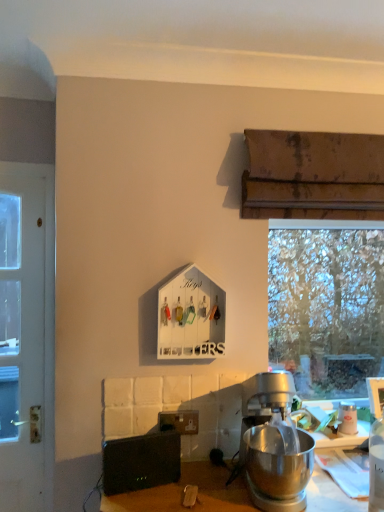
This screenshot has height=512, width=384. In order to click on white painted wood door at left in this screenshot , I will do `click(26, 337)`.

Locate an element on the screen. white glossy coffee cup at upper right is located at coordinates (347, 417).

What do you see at coordinates (326, 307) in the screenshot?
I see `transparent glass window at right` at bounding box center [326, 307].

Find the location of a particular element. This screenshot has height=512, width=384. transparent glass window at right is located at coordinates (326, 307).

You are a GUI agent. You are given a task and a screenshot of the screen. Output one action in this format:
    pyautogui.click(x=<x>, y=<y>)
    Task: Click on the white painted wood door at left
    
    Given the screenshot: What is the action you would take?
    pyautogui.click(x=26, y=337)

Is white glossy coffee cup at upper right shorter than transparent glass window at right?

Correct, white glossy coffee cup at upper right is not as tall as transparent glass window at right.

Is white glossy coffee cup at upper right turned away from transparent glass window at right?

Absolutely, white glossy coffee cup at upper right is directed away from transparent glass window at right.

From the image's perspective, is white glossy coffee cup at upper right below transparent glass window at right?

Yes, from the image's perspective, white glossy coffee cup at upper right is beneath transparent glass window at right.

Is transparent glass window at right beside white painted wood door at left?

No, transparent glass window at right is not touching white painted wood door at left.

Which of these two, transparent glass window at right or white painted wood door at left, is thinner?

With smaller width is white painted wood door at left.

From a real-world perspective, who is located higher, transparent glass window at right or white painted wood door at left?

transparent glass window at right is physically above.

Between point (318, 339) and point (27, 508), which one is positioned behind?

The point (318, 339) is farther.

In terms of width, does white glossy coffee cup at upper right look wider or thinner when compared to white painted wood door at left?

In the image, white glossy coffee cup at upper right appears to be more narrow than white painted wood door at left.

In the image, is white glossy coffee cup at upper right positioned in front of or behind white painted wood door at left?

In the image, white glossy coffee cup at upper right appears in front of white painted wood door at left.

Which point is more distant from viewer, (343, 413) or (17, 256)?

Positioned behind is point (17, 256).

Who is bigger, black plastic speaker at lower left or white painted wood door at left?

Bigger between the two is white painted wood door at left.

In the scene shown: Is black plastic speaker at lower left in front of or behind white painted wood door at left in the image?

In the image, black plastic speaker at lower left appears in front of white painted wood door at left.

Which object is wider, black plastic speaker at lower left or white painted wood door at left?

white painted wood door at left is wider.

Does white glossy coffee cup at upper right have a lesser height compared to black plastic speaker at lower left?

Indeed, white glossy coffee cup at upper right has a lesser height compared to black plastic speaker at lower left.

Considering the positions of objects white glossy coffee cup at upper right and black plastic speaker at lower left in the image provided, who is more to the left, white glossy coffee cup at upper right or black plastic speaker at lower left?

black plastic speaker at lower left is more to the left.

Would you say white glossy coffee cup at upper right is a long distance from black plastic speaker at lower left?

They are positioned close to each other.

Which is in front, white glossy coffee cup at upper right or black plastic speaker at lower left?

black plastic speaker at lower left is more forward.

Find the location of a particular element. appliance that is in front of the white glossy coffee cup at upper right is located at coordinates (141, 462).

Is black plastic speaker at lower left aimed at white glossy coffee cup at upper right?

No.

In the scene shown: Can you confirm if black plastic speaker at lower left is taller than white glossy coffee cup at upper right?

Correct, black plastic speaker at lower left is much taller as white glossy coffee cup at upper right.

Looking at this image, from a real-world perspective, is black plastic speaker at lower left on white glossy coffee cup at upper right?

No.

In the scene shown: Is transparent glass window at right taller than black plastic speaker at lower left?

Correct, transparent glass window at right is much taller as black plastic speaker at lower left.

Is transparent glass window at right facing away from black plastic speaker at lower left?

transparent glass window at right is not turned away from black plastic speaker at lower left.

From a real-world perspective, is transparent glass window at right physically below black plastic speaker at lower left?

No, from a real-world perspective, transparent glass window at right is not below black plastic speaker at lower left.

Is transparent glass window at right to the right of black plastic speaker at lower left from the viewer's perspective?

Correct, you'll find transparent glass window at right to the right of black plastic speaker at lower left.

Identify the location of window that appears above the white glossy coffee cup at upper right (from the image's perspective). The image size is (384, 512). (326, 307).

Locate an element on the screen. window that is on the right side of white painted wood door at left is located at coordinates (326, 307).

Estimate the real-world distances between objects in this image. Which object is closer to transparent glass window at right, black plastic speaker at lower left or white painted wood door at left?

black plastic speaker at lower left lies closer to transparent glass window at right than the other object.

Which object lies nearer to the anchor point transparent glass window at right, white painted wood door at left or white glossy coffee cup at upper right?

white glossy coffee cup at upper right lies closer to transparent glass window at right than the other object.

In the scene shown: Looking at the image, which one is located further to transparent glass window at right, white glossy coffee cup at upper right or white painted wood door at left?

white painted wood door at left is positioned further to the anchor transparent glass window at right.

From the image, which object appears to be farther from white painted wood door at left, white glossy coffee cup at upper right or black plastic speaker at lower left?

Based on the image, white glossy coffee cup at upper right appears to be further to white painted wood door at left.

Which object lies nearer to the anchor point white glossy coffee cup at upper right, transparent glass window at right or black plastic speaker at lower left?

black plastic speaker at lower left is closer to white glossy coffee cup at upper right.

Looking at the image, which one is located closer to black plastic speaker at lower left, white painted wood door at left or transparent glass window at right?

white painted wood door at left.

Based on their spatial positions, is black plastic speaker at lower left or transparent glass window at right closer to white painted wood door at left?

Based on the image, black plastic speaker at lower left appears to be nearer to white painted wood door at left.

Looking at the image, which one is located closer to black plastic speaker at lower left, white glossy coffee cup at upper right or white painted wood door at left?

Among the two, white painted wood door at left is located nearer to black plastic speaker at lower left.

You are a GUI agent. You are given a task and a screenshot of the screen. Output one action in this format:
    pyautogui.click(x=<x>, y=<y>)
    Task: Click on the appliance between white painted wood door at left and white glossy coffee cup at upper right in the horizontal direction
    This screenshot has width=384, height=512.
    Given the screenshot: What is the action you would take?
    pyautogui.click(x=141, y=462)

Locate an element on the screen. coffee cup between black plastic speaker at lower left and transparent glass window at right is located at coordinates (347, 417).

Locate an element on the screen. appliance located between white painted wood door at left and transparent glass window at right in the left-right direction is located at coordinates (141, 462).

Where is `coffee cup located between white painted wood door at left and transparent glass window at right in the left-right direction`? Image resolution: width=384 pixels, height=512 pixels. coffee cup located between white painted wood door at left and transparent glass window at right in the left-right direction is located at coordinates (347, 417).